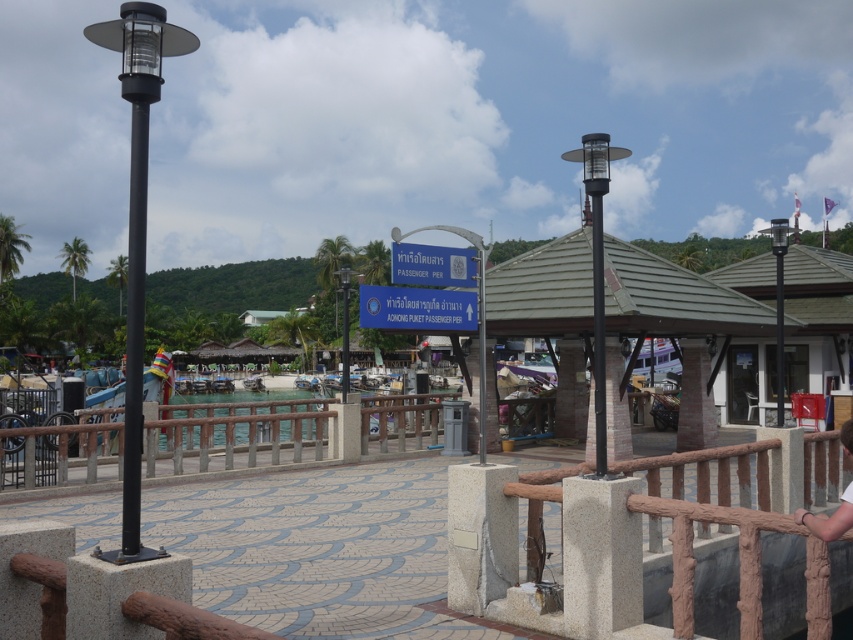
Between black metal pole at left and light brown wooden railing at lower right, which one appears on the right side from the viewer's perspective?

Positioned to the right is light brown wooden railing at lower right.

Does black metal pole at left come in front of light brown wooden railing at lower right?

Yes, black metal pole at left is closer to the viewer.

I want to click on black metal pole at left, so click(x=134, y=336).

Between brown textured rail at center and light brown wooden railing at lower right, which one appears on the right side from the viewer's perspective?

From the viewer's perspective, light brown wooden railing at lower right appears more on the right side.

Does brown textured rail at center have a lesser height compared to light brown wooden railing at lower right?

No, brown textured rail at center is not shorter than light brown wooden railing at lower right.

Describe the element at coordinates (672, 548) in the screenshot. I see `brown textured rail at center` at that location.

This screenshot has width=853, height=640. I want to click on brown textured rail at center, so click(672, 548).

Can you confirm if rustic wood rail at lower center is thinner than light brown wooden railing at lower right?

Incorrect, rustic wood rail at lower center's width is not less than light brown wooden railing at lower right's.

Does rustic wood rail at lower center have a greater height compared to light brown wooden railing at lower right?

Yes.

What do you see at coordinates (286, 433) in the screenshot? I see `rustic wood rail at lower center` at bounding box center [286, 433].

You are a GUI agent. You are given a task and a screenshot of the screen. Output one action in this format:
    pyautogui.click(x=<x>, y=<y>)
    Task: Click on the rustic wood rail at lower center
    
    Given the screenshot: What is the action you would take?
    pyautogui.click(x=286, y=433)